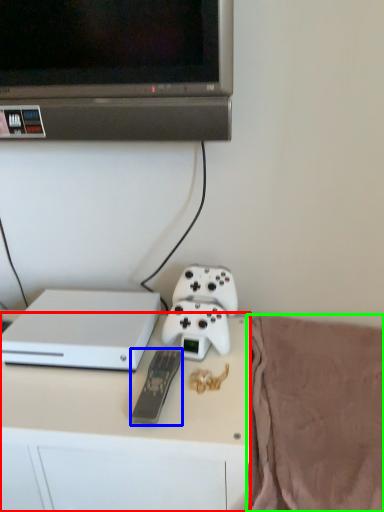
Question: Estimate the real-world distances between objects in this image. Which object is farther from desk (highlighted by a red box), remote (highlighted by a blue box) or blanket (highlighted by a green box)?

Choices:
 (A) remote
 (B) blanket

Answer: (B)